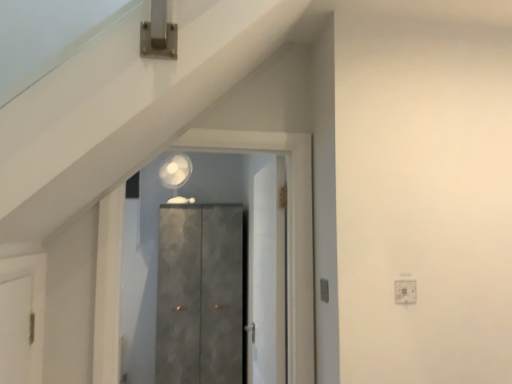
Question: Considering their positions, is matte gray cabinet at center, which appears as the 1th door when viewed from the back, located in front of or behind matte gray cabinet at center, which appears as the 1th door when viewed from the front?

Choices:
 (A) behind
 (B) front

Answer: (A)

Question: From a real-world perspective, relative to matte gray cabinet at center, which appears as the 3th door when viewed from the back, is matte gray cabinet at center, the third door from the front, vertically above or below?

Choices:
 (A) above
 (B) below

Answer: (B)

Question: Based on their relative distances, which object is nearer to the matte gray cabinet at center, which appears as the 3th door when viewed from the back?

Choices:
 (A) matte gray cabinet at center, the third door from the front
 (B) white matte door at center, placed as the 2th door when sorted from front to back

Answer: (B)

Question: Which object is positioned closest to the matte gray cabinet at center, which appears as the 1th door when viewed from the front?

Choices:
 (A) white matte door at center, which ranks as the 2th door in back-to-front order
 (B) matte gray cabinet at center, the third door from the front

Answer: (A)